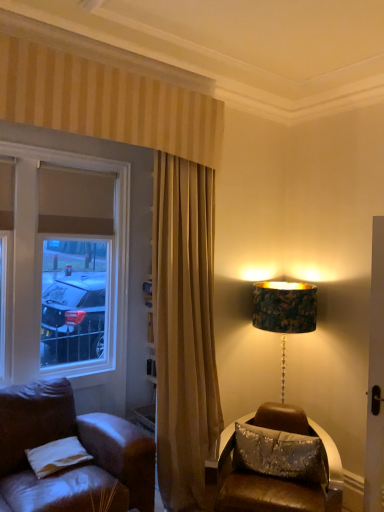
Question: From the image's perspective, is white fabric pillow at lower left, the 2th pillow in the right-to-left sequence, located above or below matte glass window at left?

Choices:
 (A) below
 (B) above

Answer: (A)

Question: In the image, is white fabric pillow at lower left, the 2th pillow in the right-to-left sequence, on the left side or the right side of matte glass window at left?

Choices:
 (A) left
 (B) right

Answer: (B)

Question: Estimate the real-world distances between objects in this image. Which object is closer to the white fabric pillow at lower left, the 2th pillow in the right-to-left sequence?

Choices:
 (A) shiny brown leather chair at lower right
 (B) matte glass window at left
 (C) sparkly silver pillow at lower right, the second pillow positioned from the left

Answer: (A)

Question: Estimate the real-world distances between objects in this image. Which object is farther from the white fabric pillow at lower left, arranged as the first pillow when viewed from the left?

Choices:
 (A) matte glass window at left
 (B) sparkly silver pillow at lower right, which is the 1th pillow from right to left
 (C) shiny brown leather chair at lower right

Answer: (B)